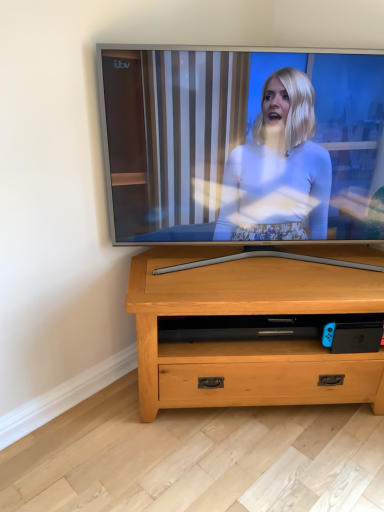
Question: Is the surface of silver glossy tv at center in direct contact with light wood chest of drawers at center?

Choices:
 (A) yes
 (B) no

Answer: (B)

Question: From a real-world perspective, is silver glossy tv at center below light wood chest of drawers at center?

Choices:
 (A) yes
 (B) no

Answer: (B)

Question: Is silver glossy tv at center far away from light wood chest of drawers at center?

Choices:
 (A) yes
 (B) no

Answer: (B)

Question: Does silver glossy tv at center have a greater height compared to light wood chest of drawers at center?

Choices:
 (A) no
 (B) yes

Answer: (B)

Question: From a real-world perspective, is silver glossy tv at center on top of light wood chest of drawers at center?

Choices:
 (A) yes
 (B) no

Answer: (A)

Question: Would you say light wood chest of drawers at center is part of silver glossy tv at center's contents?

Choices:
 (A) no
 (B) yes

Answer: (A)

Question: Can you confirm if light wood chest of drawers at center is positioned to the right of silver glossy tv at center?

Choices:
 (A) no
 (B) yes

Answer: (B)

Question: From a real-world perspective, is light wood chest of drawers at center on top of silver glossy tv at center?

Choices:
 (A) yes
 (B) no

Answer: (B)

Question: From the image's perspective, would you say light wood chest of drawers at center is shown under silver glossy tv at center?

Choices:
 (A) yes
 (B) no

Answer: (A)

Question: Is light wood chest of drawers at center oriented towards silver glossy tv at center?

Choices:
 (A) yes
 (B) no

Answer: (B)

Question: Is silver glossy tv at center located within light wood chest of drawers at center?

Choices:
 (A) no
 (B) yes

Answer: (A)

Question: Considering the relative sizes of light wood chest of drawers at center and silver glossy tv at center in the image provided, is light wood chest of drawers at center smaller than silver glossy tv at center?

Choices:
 (A) yes
 (B) no

Answer: (B)

Question: From their relative heights in the image, would you say light wood chest of drawers at center is taller or shorter than silver glossy tv at center?

Choices:
 (A) tall
 (B) short

Answer: (B)